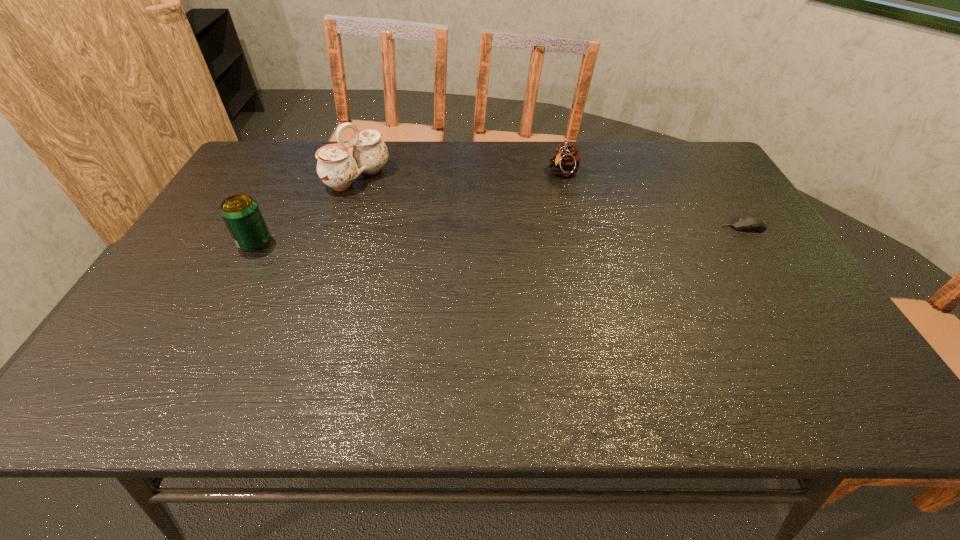
In order to click on free space at the far edge in this screenshot , I will do `click(577, 147)`.

In the image, there is a desktop. Where is `free space at the near edge`? The width and height of the screenshot is (960, 540). free space at the near edge is located at coordinates [x=226, y=352].

This screenshot has height=540, width=960. Find the location of `vacant space at the left edge`. vacant space at the left edge is located at coordinates (239, 183).

Identify the location of vacant space at the right edge of the desktop. The image size is (960, 540). (739, 212).

In the image, there is a desktop. Identify the location of vacant space at the far left corner. The image size is (960, 540). (281, 141).

You are a GUI agent. You are given a task and a screenshot of the screen. Output one action in this format:
    pyautogui.click(x=<x>, y=<y>)
    Task: Click on the vacant space in between the shortest object and the chinaware
    
    Given the screenshot: What is the action you would take?
    pyautogui.click(x=550, y=202)

Locate an element on the screen. free space between the computer mouse and the leftmost object is located at coordinates (499, 234).

Identify the location of empty space between the second object from right to left and the third object from right to left. (461, 175).

What are the coordinates of `unoccupied area between the leftmost object and the third tallest object` in the screenshot? It's located at (410, 208).

At what (x,y) coordinates should I click in order to perform the action: click on blank region between the third object from left to right and the shortest object. Please return your answer as a coordinate pair (x, y). Looking at the image, I should click on (654, 200).